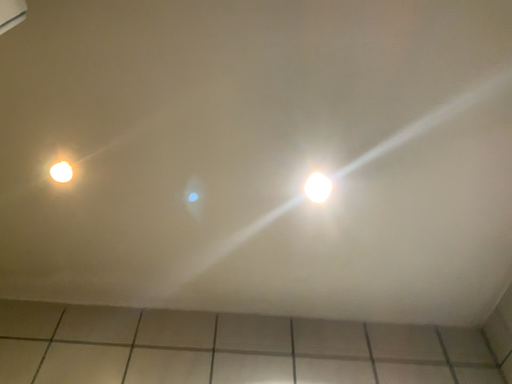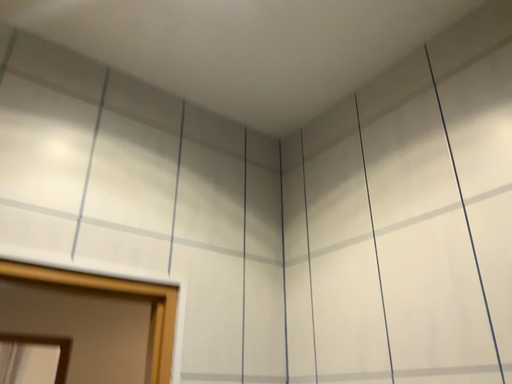
Question: How did the camera likely rotate when shooting the video?

Choices:
 (A) rotated downward
 (B) rotated upward

Answer: (A)